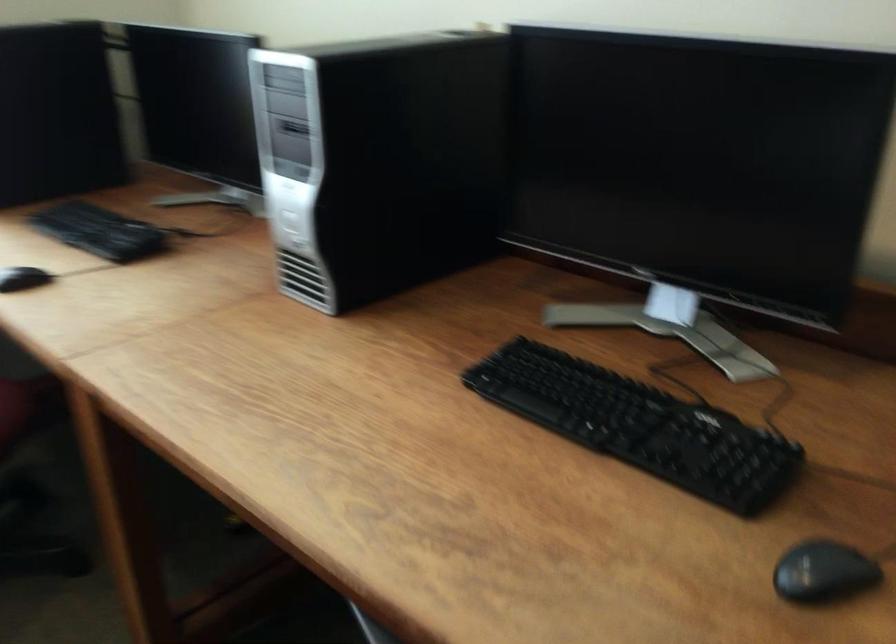
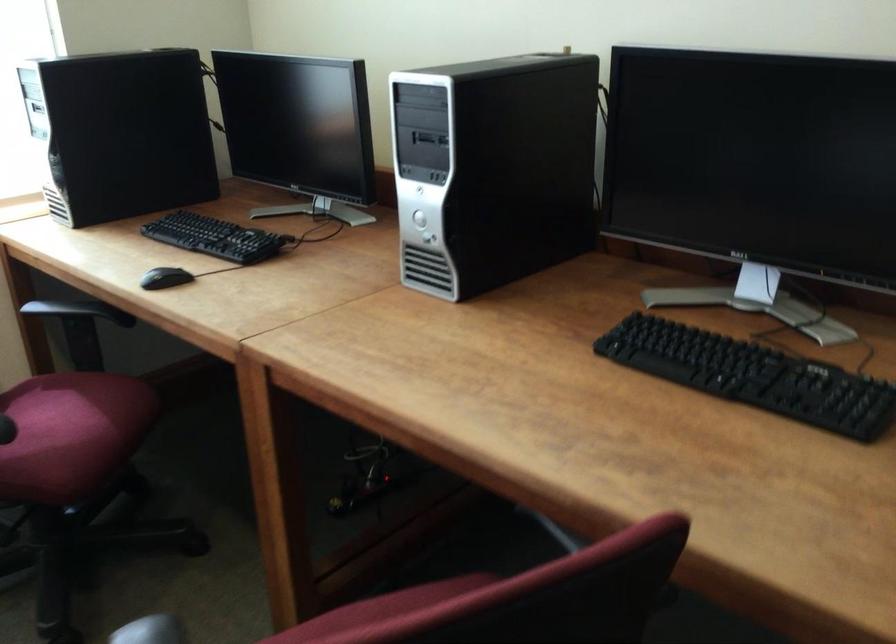
Where in the second image is the point corresponding to point 288,219 from the first image?

(418, 219)